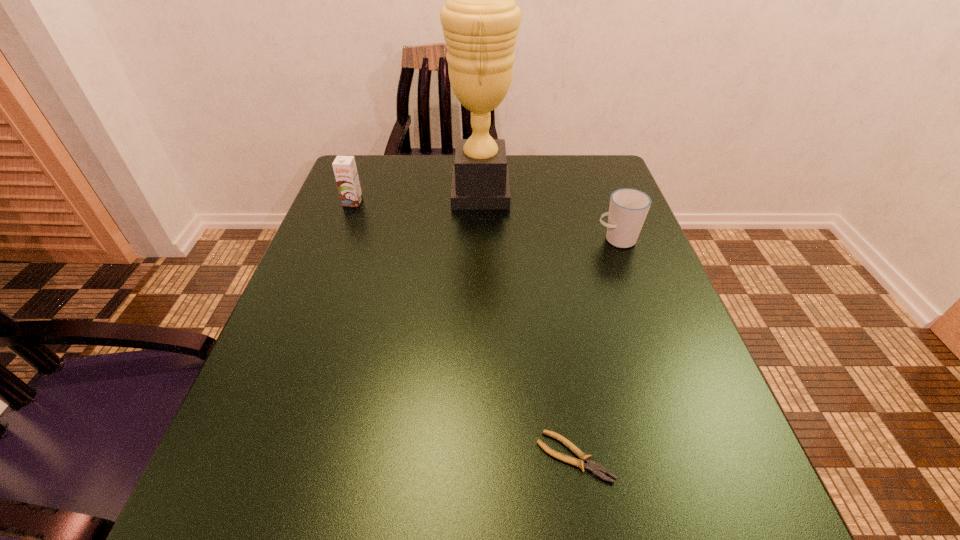
At what (x,y) coordinates should I click in order to perform the action: click on the tallest object. Please return your answer as a coordinate pair (x, y). The image size is (960, 540). Looking at the image, I should click on (480, 19).

At what (x,y) coordinates should I click in order to perform the action: click on trophy cup. Please return your answer as a coordinate pair (x, y). This screenshot has width=960, height=540. Looking at the image, I should click on (480, 19).

Where is `the leftmost object`? The image size is (960, 540). the leftmost object is located at coordinates (345, 170).

The width and height of the screenshot is (960, 540). Identify the location of the second nearest object. (628, 208).

Where is `the rightmost object`? The image size is (960, 540). the rightmost object is located at coordinates (628, 208).

Where is `the nearest object`? The height and width of the screenshot is (540, 960). the nearest object is located at coordinates (590, 465).

Locate an element on the screen. pliers is located at coordinates (590, 465).

I want to click on vacant space located at the front of the second object from left to right with handles, so click(x=421, y=192).

The height and width of the screenshot is (540, 960). In order to click on blank area located at the front of the second object from left to right with handles in this screenshot , I will do `click(365, 192)`.

Find the location of a particular element. This screenshot has height=540, width=960. vacant position located at the front of the second object from left to right with handles is located at coordinates (393, 192).